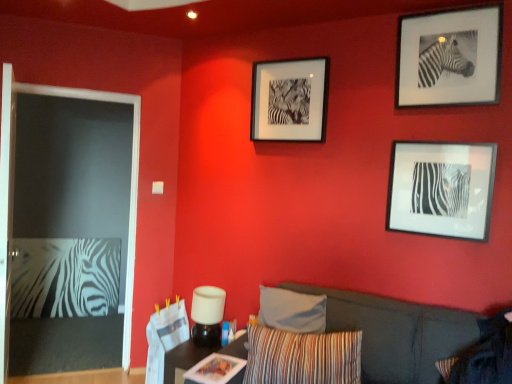
Where is `free space above black matte picture frame at upper right, the third picture frame viewed from the left (from a real-world perspective)`? free space above black matte picture frame at upper right, the third picture frame viewed from the left (from a real-world perspective) is located at coordinates (451, 6).